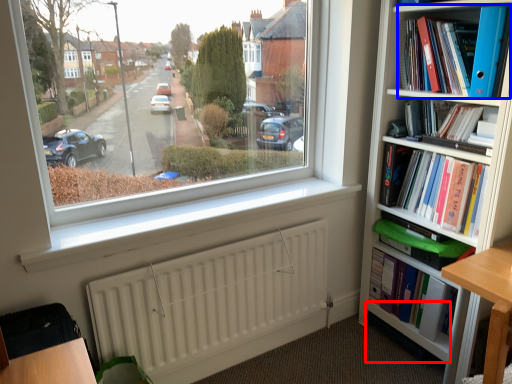
Question: Which object is further to the camera taking this photo, shelf (highlighted by a red box) or book (highlighted by a blue box)?

Choices:
 (A) shelf
 (B) book

Answer: (A)